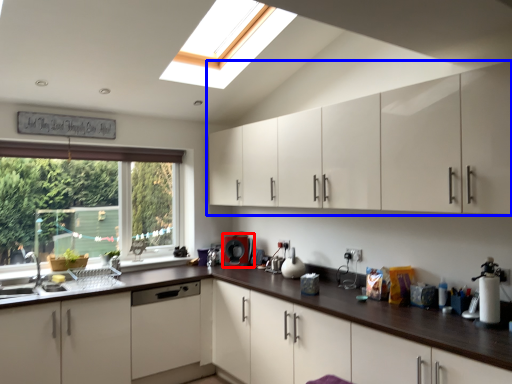
Question: Which point is further to the camera, coffee machine (highlighted by a red box) or cabinetry (highlighted by a blue box)?

Choices:
 (A) coffee machine
 (B) cabinetry

Answer: (A)